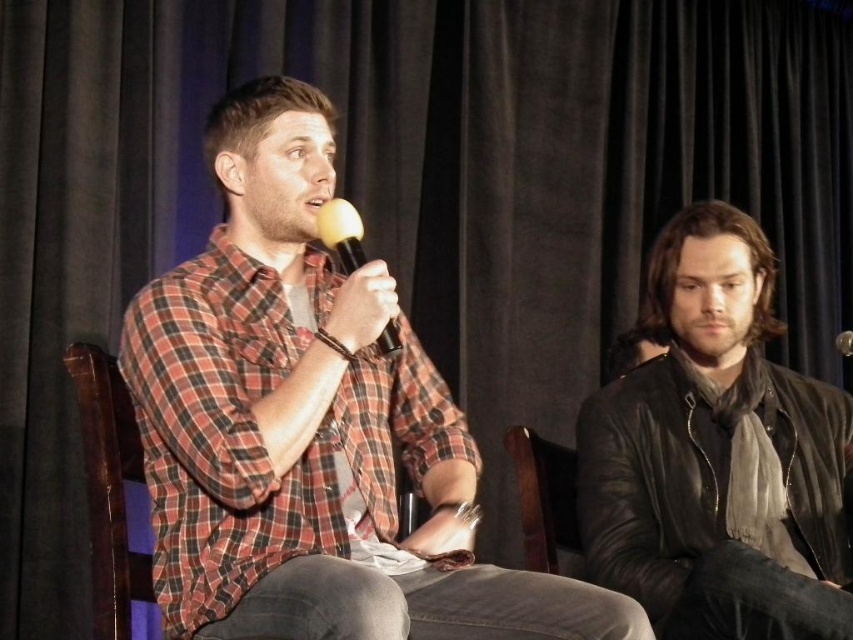
Question: Which point is closer to the camera taking this photo?

Choices:
 (A) (558, 532)
 (B) (656, 602)

Answer: (B)

Question: Which of these objects is positioned farthest from the leather jacket at right?

Choices:
 (A) yellow matte microphone at center
 (B) brown leather chair at center
 (C) plaid shirt at center

Answer: (A)

Question: Considering the real-world distances, which object is closest to the leather jacket at right?

Choices:
 (A) brown leather chair at center
 (B) plaid shirt at center

Answer: (A)

Question: Can you confirm if brown leather chair at center is thinner than yellow matte microphone at center?

Choices:
 (A) no
 (B) yes

Answer: (A)

Question: From the image, what is the correct spatial relationship of plaid shirt at center in relation to leather jacket at right?

Choices:
 (A) right
 (B) left

Answer: (B)

Question: Does plaid shirt at center have a smaller size compared to yellow matte microphone at center?

Choices:
 (A) no
 (B) yes

Answer: (A)